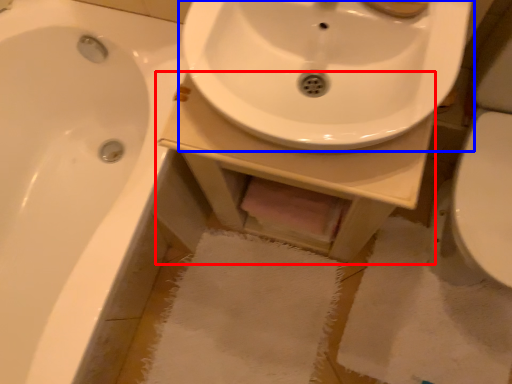
Question: Which object is closer to the camera taking this photo, counter top (highlighted by a red box) or sink (highlighted by a blue box)?

Choices:
 (A) counter top
 (B) sink

Answer: (B)